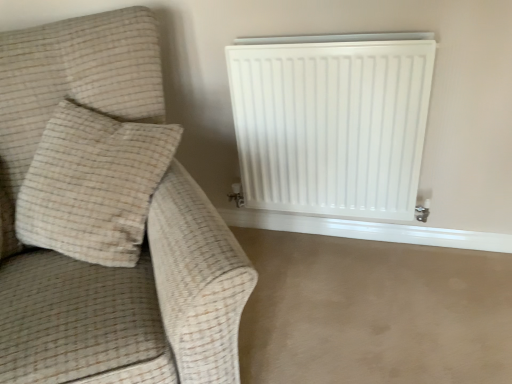
Question: From their relative heights in the image, would you say beige textured pillow at left is taller or shorter than beige fabric couch at left?

Choices:
 (A) short
 (B) tall

Answer: (A)

Question: From a real-world perspective, is beige textured pillow at left above or below beige fabric couch at left?

Choices:
 (A) below
 (B) above

Answer: (B)

Question: Which object is the closest to the beige textured pillow at left?

Choices:
 (A) beige carpet at lower right
 (B) white matte radiator at upper right
 (C) beige fabric couch at left

Answer: (C)

Question: Considering the real-world distances, which object is farthest from the white matte radiator at upper right?

Choices:
 (A) beige fabric couch at left
 (B) beige textured pillow at left
 (C) beige carpet at lower right

Answer: (A)